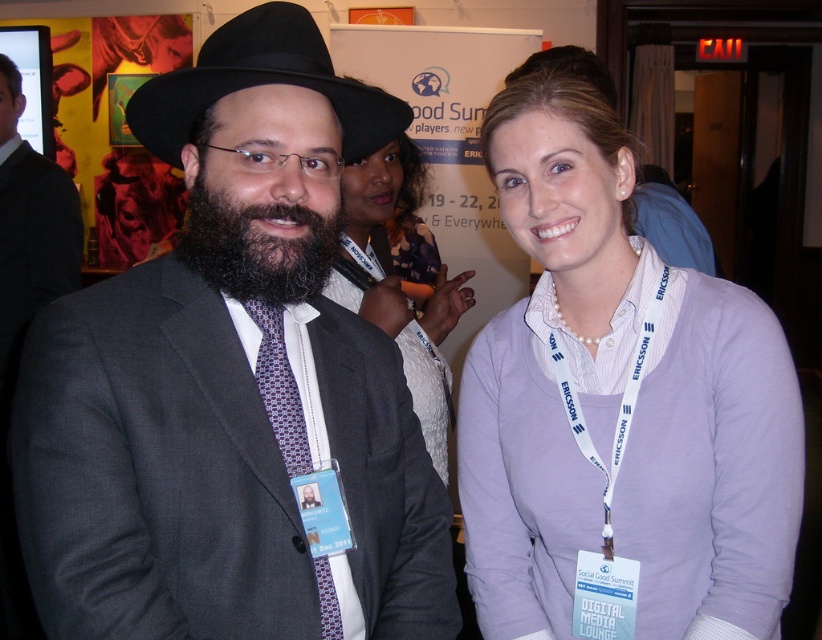
Question: Which object is positioned closest to the black felt fedora at center?

Choices:
 (A) matte gray suit at center
 (B) white matte shirt at center
 (C) dark brown fuzzy beard at center
 (D) patterned silk tie at center

Answer: (C)

Question: Is matte white shirt at center positioned behind dark brown fuzzy beard at center?

Choices:
 (A) no
 (B) yes

Answer: (B)

Question: Is white matte shirt at center below dark brown fuzzy beard at center?

Choices:
 (A) no
 (B) yes

Answer: (B)

Question: Is the position of white matte shirt at center more distant than that of patterned silk tie at center?

Choices:
 (A) no
 (B) yes

Answer: (B)

Question: Which point appears closest to the camera in this image?

Choices:
 (A) (224, 234)
 (B) (192, 81)
 (C) (328, 570)
 (D) (704, 472)

Answer: (B)

Question: Which point is closer to the camera taking this photo?

Choices:
 (A) (201, 234)
 (B) (291, 385)

Answer: (A)